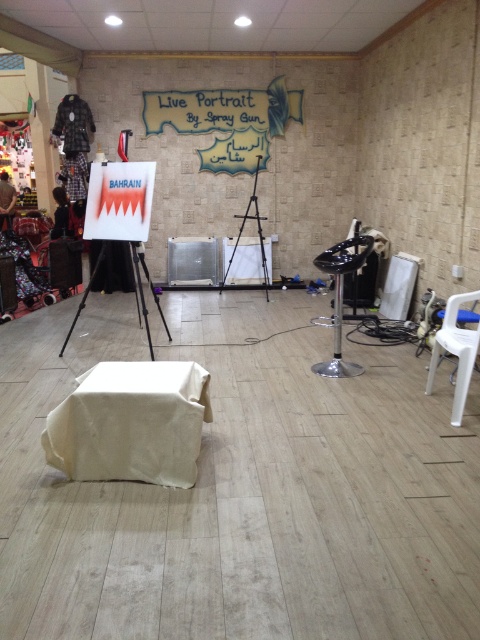
You are setting up equipment in the room for an event. You need to place a new camera on one of the tripods. The camera requires a tripod that is positioned higher up to capture the entire canvas. Which tripod should you choose between the white matte tripod at center and the wooden tripod at center?

The wooden tripod at center is positioned higher than the white matte tripod at center, so you should choose the wooden tripod at center to place the camera.